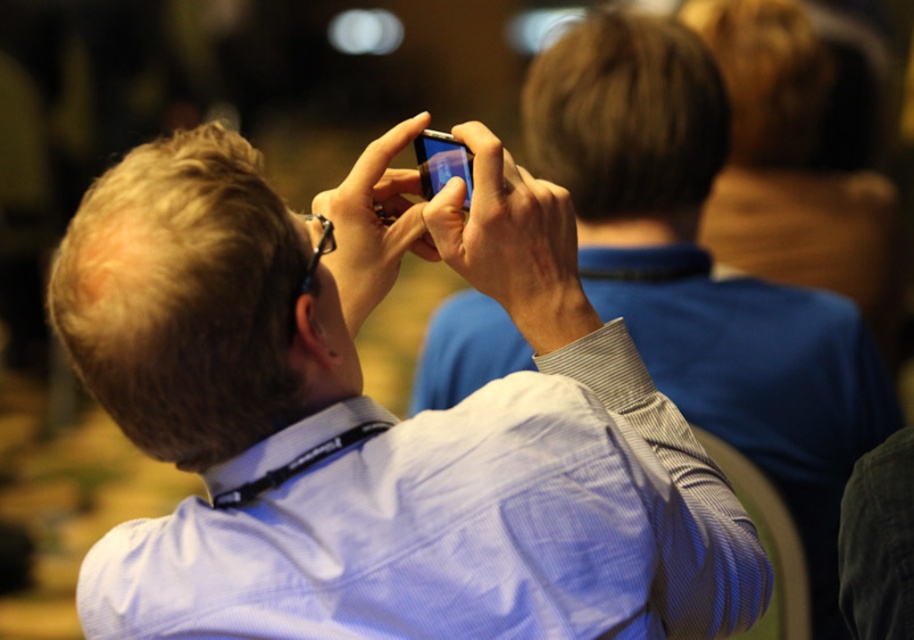
Can you confirm if matte black phone at upper center is taller than matte blue shirt at center?

Incorrect, matte black phone at upper center's height is not larger of matte blue shirt at center's.

Is matte black phone at upper center positioned before matte blue shirt at center?

Yes, it is.

Between point (241, 561) and point (813, 401), which one is positioned in front?

Positioned in front is point (241, 561).

The height and width of the screenshot is (640, 914). Find the location of `matte black phone at upper center`. matte black phone at upper center is located at coordinates (379, 419).

Does point (752, 584) come behind point (424, 136)?

That is False.

Identify the location of matte black phone at upper center. (379, 419).

At what (x,y) coordinates should I click in order to perform the action: click on matte black phone at upper center. Please return your answer as a coordinate pair (x, y). The image size is (914, 640). Looking at the image, I should click on (379, 419).

Who is positioned more to the right, matte blue shirt at center or matte black smartphone at center?

Positioned to the right is matte blue shirt at center.

Between matte blue shirt at center and matte black smartphone at center, which one has more height?

matte blue shirt at center

In the scene shown: Measure the distance between point (812,496) and camera.

Point (812,496) is 1.80 meters from camera.

Locate an element on the screen. matte blue shirt at center is located at coordinates (702, 273).